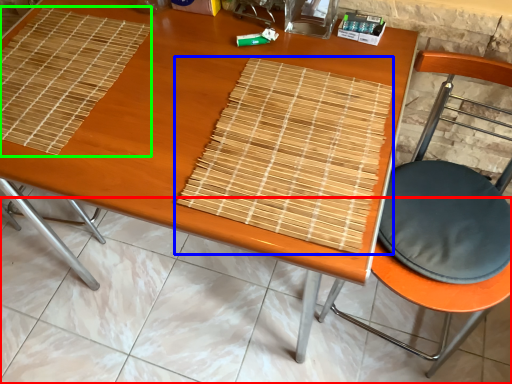
Question: Which object is positioned farthest from tile (highlighted by a red box)? Select from mat (highlighted by a blue box) and mat (highlighted by a green box).

Choices:
 (A) mat
 (B) mat

Answer: (A)